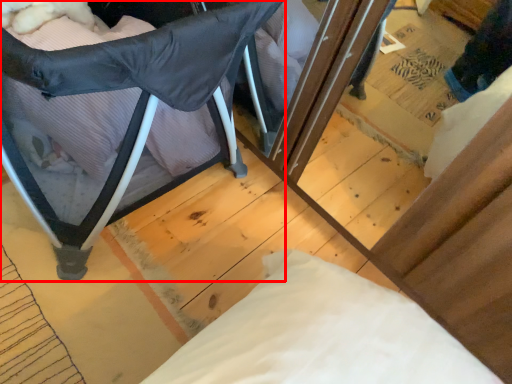
Question: Where is furniture (annotated by the red box) located in relation to pillow in the image?

Choices:
 (A) right
 (B) left

Answer: (B)